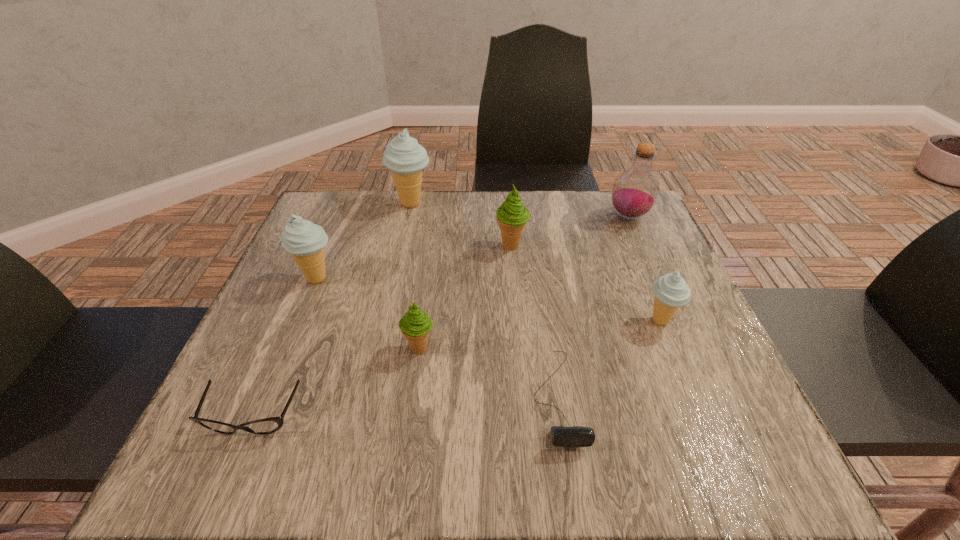
I want to click on spectacles present at the near edge, so click(x=267, y=425).

Find the location of a particular element. Image resolution: width=960 pixels, height=540 pixels. webcam located at the near edge is located at coordinates (576, 436).

At what (x,y) coordinates should I click in order to perform the action: click on icecream that is at the left edge. Please return your answer as a coordinate pair (x, y). Looking at the image, I should click on click(x=305, y=241).

The height and width of the screenshot is (540, 960). In order to click on spectacles located in the left edge section of the desktop in this screenshot , I will do `click(267, 425)`.

Image resolution: width=960 pixels, height=540 pixels. Find the location of `bottle that is at the right edge`. bottle that is at the right edge is located at coordinates (635, 191).

The image size is (960, 540). In order to click on icecream that is positioned at the right edge in this screenshot , I will do `click(671, 291)`.

At what (x,y) coordinates should I click in order to perform the action: click on object that is positioned at the near left corner. Please return your answer as a coordinate pair (x, y). The height and width of the screenshot is (540, 960). Looking at the image, I should click on click(267, 425).

At what (x,y) coordinates should I click in order to perform the action: click on object located in the far right corner section of the desktop. Please return your answer as a coordinate pair (x, y). Image resolution: width=960 pixels, height=540 pixels. Looking at the image, I should click on (635, 191).

The height and width of the screenshot is (540, 960). I want to click on vacant space at the far edge of the desktop, so click(x=493, y=242).

Identify the location of blank space at the left edge. (x=295, y=318).